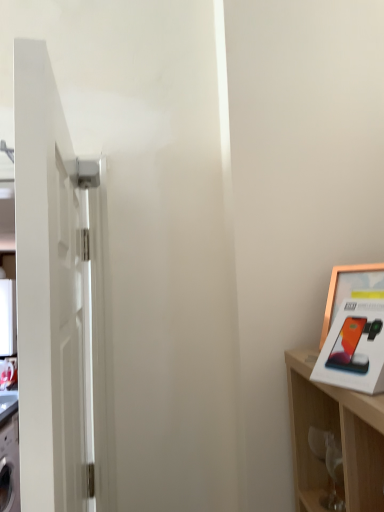
What do you see at coordinates (51, 294) in the screenshot? I see `white glossy door at left` at bounding box center [51, 294].

The width and height of the screenshot is (384, 512). In order to click on white glossy door at left in this screenshot , I will do `click(51, 294)`.

This screenshot has width=384, height=512. In order to click on gold metallic picture frame at upper right in this screenshot , I will do `click(351, 289)`.

What is the approximate width of gold metallic picture frame at upper right?

3.85 inches.

Image resolution: width=384 pixels, height=512 pixels. What do you see at coordinates (351, 289) in the screenshot? I see `gold metallic picture frame at upper right` at bounding box center [351, 289].

I want to click on white glossy door at left, so click(x=51, y=294).

Considering the positions of objects white glossy door at left and gold metallic picture frame at upper right in the image provided, who is more to the right, white glossy door at left or gold metallic picture frame at upper right?

From the viewer's perspective, gold metallic picture frame at upper right appears more on the right side.

Which object is closer to the camera taking this photo, white glossy door at left or gold metallic picture frame at upper right?

white glossy door at left is closer to the camera.

Does point (57, 245) appear closer or farther from the camera than point (345, 297)?

Clearly, point (57, 245) is closer to the camera than point (345, 297).

From the image's perspective, which is above, white glossy door at left or gold metallic picture frame at upper right?

gold metallic picture frame at upper right is shown above in the image.

From a real-world perspective, which object stands above the other?

gold metallic picture frame at upper right, from a real-world perspective.

Considering the sizes of white glossy door at left and gold metallic picture frame at upper right in the image, is white glossy door at left wider or thinner than gold metallic picture frame at upper right?

Clearly, white glossy door at left has more width compared to gold metallic picture frame at upper right.

Does white glossy door at left have a greater height compared to gold metallic picture frame at upper right?

Yes.

In the scene shown: Who is smaller, white glossy door at left or gold metallic picture frame at upper right?

gold metallic picture frame at upper right.

Is white glossy door at left positioned beyond the bounds of gold metallic picture frame at upper right?

white glossy door at left is positioned outside gold metallic picture frame at upper right.

Is white glossy door at left far from gold metallic picture frame at upper right?

No, white glossy door at left is in close proximity to gold metallic picture frame at upper right.

Is white glossy door at left oriented away from gold metallic picture frame at upper right?

Correct, white glossy door at left is looking away from gold metallic picture frame at upper right.

How many degrees apart are the facing directions of white glossy door at left and gold metallic picture frame at upper right?

They differ by 27.5 degrees in their facing directions.

How distant is white glossy door at left from gold metallic picture frame at upper right?

white glossy door at left and gold metallic picture frame at upper right are 26.02 inches apart.

Where is `picture frame that is above the white glossy door at left (from a real-world perspective)`? The height and width of the screenshot is (512, 384). picture frame that is above the white glossy door at left (from a real-world perspective) is located at coordinates (351, 289).

Is gold metallic picture frame at upper right to the right of white glossy door at left from the viewer's perspective?

Yes, gold metallic picture frame at upper right is to the right of white glossy door at left.

Is gold metallic picture frame at upper right positioned behind white glossy door at left?

Yes, it is.

Considering the points (324, 316) and (36, 352), which point is behind, point (324, 316) or point (36, 352)?

Positioned behind is point (324, 316).

From the image's perspective, which is below, gold metallic picture frame at upper right or white glossy door at left?

white glossy door at left appears lower in the image.

From a real-world perspective, is gold metallic picture frame at upper right over white glossy door at left?

Correct, in the physical world, gold metallic picture frame at upper right is higher than white glossy door at left.

Based on the photo, looking at their sizes, would you say gold metallic picture frame at upper right is wider or thinner than white glossy door at left?

Considering their sizes, gold metallic picture frame at upper right looks slimmer than white glossy door at left.

Is gold metallic picture frame at upper right shorter than white glossy door at left?

Correct, gold metallic picture frame at upper right is not as tall as white glossy door at left.

Is gold metallic picture frame at upper right bigger than white glossy door at left?

No.

Is gold metallic picture frame at upper right positioned beyond the bounds of white glossy door at left?

Absolutely, gold metallic picture frame at upper right is external to white glossy door at left.

Can you see gold metallic picture frame at upper right touching white glossy door at left?

They are not placed beside each other.

Could you tell me if gold metallic picture frame at upper right is facing white glossy door at left?

Yes, gold metallic picture frame at upper right is turned towards white glossy door at left.

How different are the orientations of gold metallic picture frame at upper right and white glossy door at left in degrees?

gold metallic picture frame at upper right and white glossy door at left are facing 27.5 degrees away from each other.

Where is `picture frame located above the white glossy door at left (from the image's perspective)`? picture frame located above the white glossy door at left (from the image's perspective) is located at coordinates (351, 289).

Locate an element on the screen. This screenshot has width=384, height=512. door that appears in front of the gold metallic picture frame at upper right is located at coordinates (51, 294).

Where is `picture frame that appears on the right of white glossy door at left`? This screenshot has height=512, width=384. picture frame that appears on the right of white glossy door at left is located at coordinates (351, 289).